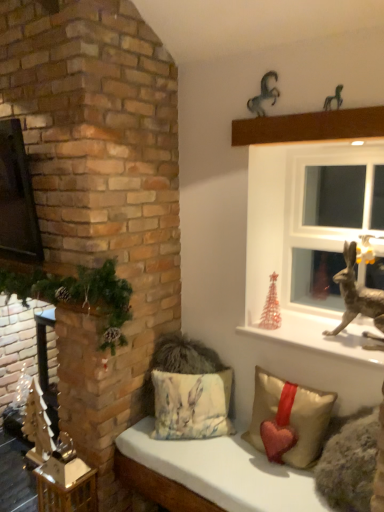
I want to click on vacant region above metallic gold statue at upper right (from a real-world perspective), so click(x=321, y=331).